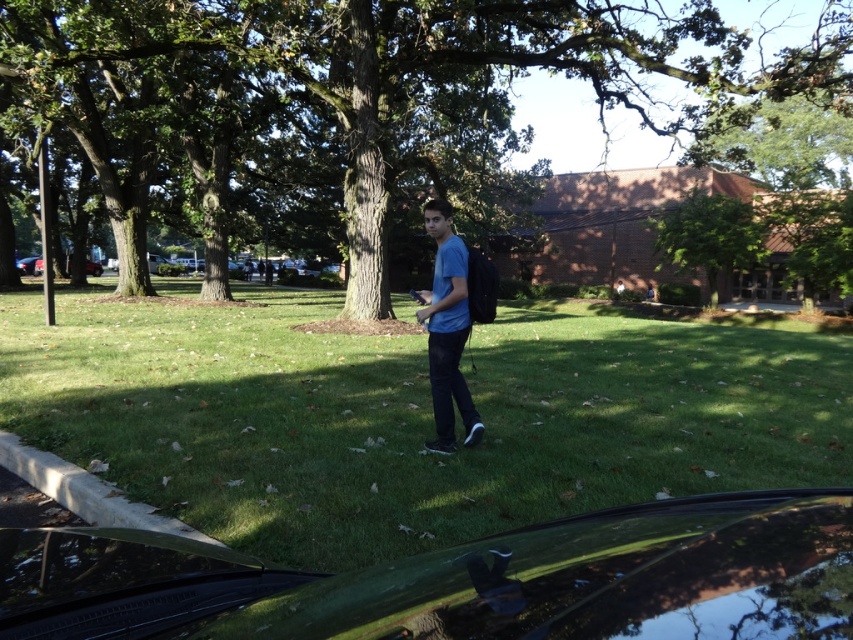
You are standing in the middle of the scene and want to walk towards the green leafy tree at center. Which direction should you move relative to the green grass at center?

You should move to the right relative to the green grass at center because the green grass at center is to the left of the green leafy tree at center.

You are standing in the outdoor scene and want to take a photo of both the green grass at center and the green leafy tree at center. Which object should you focus on first to ensure both are in clear view?

You should focus on the green grass at center first because it is closer to the viewer than the green leafy tree at center, ensuring both are in focus when using depth of field.